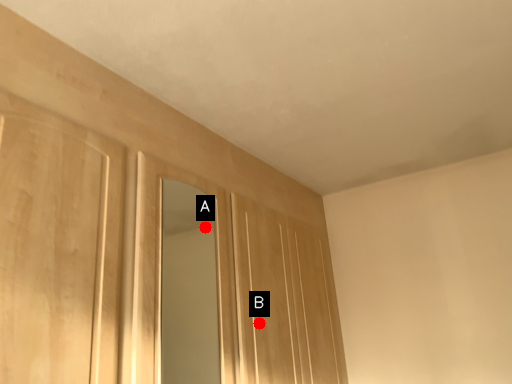
Question: Two points are circled on the image, labeled by A and B beside each circle. Which point is farther from the camera taking this photo?

Choices:
 (A) A is further
 (B) B is further

Answer: (A)